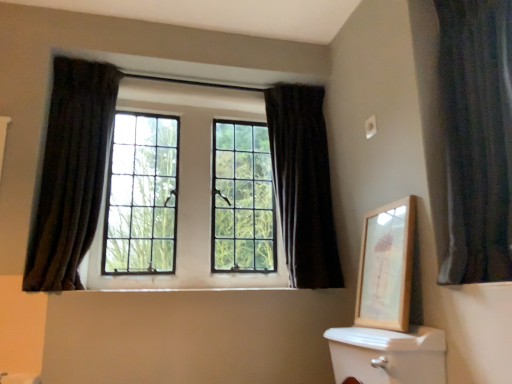
Describe the element at coordinates (476, 138) in the screenshot. I see `dark velvet curtain at right, acting as the third curtain starting from the left` at that location.

Describe the element at coordinates (303, 184) in the screenshot. I see `dark velvet curtain at upper center, the 2th curtain viewed from the left` at that location.

Find the location of a particular element. This screenshot has width=512, height=384. wooden picture frame at upper right is located at coordinates (386, 266).

From a real-world perspective, is dark velvet curtain at left, the third curtain positioned from the right, over matte glass windows at center?

→ No.

Could you tell me if dark velvet curtain at left, the third curtain positioned from the right, is turned towards matte glass windows at center?

No, dark velvet curtain at left, the third curtain positioned from the right, is not facing towards matte glass windows at center.

Considering the positions of objects dark velvet curtain at left, positioned as the 1th curtain in left-to-right order, and matte glass windows at center in the image provided, who is more to the right, dark velvet curtain at left, positioned as the 1th curtain in left-to-right order, or matte glass windows at center?

matte glass windows at center is more to the right.

Is point (40, 266) farther from viewer compared to point (141, 260)?

No, it is in front of (141, 260).

Considering the sizes of matte glass windows at center and dark velvet curtain at left, positioned as the 1th curtain in left-to-right order, in the image, is matte glass windows at center wider or thinner than dark velvet curtain at left, positioned as the 1th curtain in left-to-right order,?

Clearly, matte glass windows at center has less width compared to dark velvet curtain at left, positioned as the 1th curtain in left-to-right order.

Is point (211, 286) closer to camera compared to point (80, 95)?

That is False.

From the image's perspective, who appears lower, matte glass windows at center or dark velvet curtain at left, positioned as the 1th curtain in left-to-right order?

From the image's view, matte glass windows at center is below.

Locate an element on the screen. Image resolution: width=512 pixels, height=384 pixels. the 2nd curtain below the matte glass windows at center (from a real-world perspective) is located at coordinates (71, 173).

Is dark velvet curtain at left, the third curtain positioned from the right, in front of or behind wooden picture frame at upper right in the image?

Clearly, dark velvet curtain at left, the third curtain positioned from the right, is behind wooden picture frame at upper right.

Consider the image. Considering the relative positions of dark velvet curtain at left, the third curtain positioned from the right, and wooden picture frame at upper right in the image provided, is dark velvet curtain at left, the third curtain positioned from the right, to the right of wooden picture frame at upper right from the viewer's perspective?

In fact, dark velvet curtain at left, the third curtain positioned from the right, is to the left of wooden picture frame at upper right.

How different are the orientations of wooden picture frame at upper right and matte glass windows at center in degrees?

They differ by 88.9 degrees in their facing directions.

Considering the relative sizes of wooden picture frame at upper right and matte glass windows at center in the image provided, is wooden picture frame at upper right shorter than matte glass windows at center?

Indeed, wooden picture frame at upper right has a lesser height compared to matte glass windows at center.

Can you confirm if wooden picture frame at upper right is bigger than matte glass windows at center?

No.

Relative to matte glass windows at center, is wooden picture frame at upper right in front or behind?

Visually, wooden picture frame at upper right is located in front of matte glass windows at center.

Looking at the image, does dark velvet curtain at upper center, the 2th curtain viewed from the left, seem bigger or smaller compared to dark velvet curtain at right, acting as the third curtain starting from the left?

Clearly, dark velvet curtain at upper center, the 2th curtain viewed from the left, is larger in size than dark velvet curtain at right, acting as the third curtain starting from the left.

Which point is more forward, [314,162] or [465,102]?

The point [465,102] is in front.

Consider the image. Is dark velvet curtain at upper center, the 2th curtain viewed from the left, not near dark velvet curtain at right, which is counted as the 1th curtain, starting from the right?

No, there isn't a large distance between dark velvet curtain at upper center, the 2th curtain viewed from the left, and dark velvet curtain at right, which is counted as the 1th curtain, starting from the right.

Could you tell me if dark velvet curtain at upper center, the 2th curtain viewed from the left, is facing dark velvet curtain at right, acting as the third curtain starting from the left?

Yes, dark velvet curtain at upper center, the 2th curtain viewed from the left, is turned towards dark velvet curtain at right, acting as the third curtain starting from the left.

Would you say wooden picture frame at upper right is part of matte glass windows at center's contents?

Actually, wooden picture frame at upper right is outside matte glass windows at center.

Is matte glass windows at center in front of or behind wooden picture frame at upper right in the image?

Visually, matte glass windows at center is located behind wooden picture frame at upper right.

Considering the sizes of matte glass windows at center and wooden picture frame at upper right in the image, is matte glass windows at center bigger or smaller than wooden picture frame at upper right?

Considering their sizes, matte glass windows at center takes up more space than wooden picture frame at upper right.

From a real-world perspective, does matte glass windows at center stand above wooden picture frame at upper right?

Correct, in the physical world, matte glass windows at center is higher than wooden picture frame at upper right.

Considering the sizes of objects dark velvet curtain at upper center, the 2th curtain viewed from the left, and dark velvet curtain at left, positioned as the 1th curtain in left-to-right order, in the image provided, who is thinner, dark velvet curtain at upper center, the 2th curtain viewed from the left, or dark velvet curtain at left, positioned as the 1th curtain in left-to-right order,?

Thinner between the two is dark velvet curtain at left, positioned as the 1th curtain in left-to-right order.

From a real-world perspective, who is located higher, dark velvet curtain at upper center, the 2th curtain viewed from the left, or dark velvet curtain at left, positioned as the 1th curtain in left-to-right order?

dark velvet curtain at upper center, the 2th curtain viewed from the left, is physically above.

Is dark velvet curtain at upper center, the 2th curtain viewed from the left, oriented towards dark velvet curtain at left, the third curtain positioned from the right?

No, dark velvet curtain at upper center, the 2th curtain viewed from the left, is not aimed at dark velvet curtain at left, the third curtain positioned from the right.

Where is `bay window below the dark velvet curtain at left, positioned as the 1th curtain in left-to-right order (from the image's perspective)`? bay window below the dark velvet curtain at left, positioned as the 1th curtain in left-to-right order (from the image's perspective) is located at coordinates (190, 202).

This screenshot has height=384, width=512. Identify the location of the 2nd curtain located beneath the matte glass windows at center (from a real-world perspective). (71, 173).

From the image, which object appears to be nearer to dark velvet curtain at left, positioned as the 1th curtain in left-to-right order, matte glass windows at center or wooden picture frame at upper right?

matte glass windows at center is positioned closer to the anchor dark velvet curtain at left, positioned as the 1th curtain in left-to-right order.

Estimate the real-world distances between objects in this image. Which object is closer to wooden picture frame at upper right, matte glass windows at center or dark velvet curtain at upper center, the 2th curtain viewed from the left?

dark velvet curtain at upper center, the 2th curtain viewed from the left, is positioned closer to the anchor wooden picture frame at upper right.

From the picture: From the image, which object appears to be farther from dark velvet curtain at left, the third curtain positioned from the right, wooden picture frame at upper right or dark velvet curtain at upper center, marked as the second curtain in a right-to-left arrangement?

The object further to dark velvet curtain at left, the third curtain positioned from the right, is wooden picture frame at upper right.

Estimate the real-world distances between objects in this image. Which object is further from dark velvet curtain at upper center, marked as the second curtain in a right-to-left arrangement, dark velvet curtain at right, which is counted as the 1th curtain, starting from the right, or dark velvet curtain at left, the third curtain positioned from the right?

Based on the image, dark velvet curtain at left, the third curtain positioned from the right, appears to be further to dark velvet curtain at upper center, marked as the second curtain in a right-to-left arrangement.

Which object lies nearer to the anchor point dark velvet curtain at upper center, marked as the second curtain in a right-to-left arrangement, matte glass windows at center or dark velvet curtain at right, acting as the third curtain starting from the left?

The object closer to dark velvet curtain at upper center, marked as the second curtain in a right-to-left arrangement, is matte glass windows at center.

Considering their positions, is wooden picture frame at upper right positioned further to dark velvet curtain at right, which is counted as the 1th curtain, starting from the right, than dark velvet curtain at upper center, marked as the second curtain in a right-to-left arrangement?

dark velvet curtain at upper center, marked as the second curtain in a right-to-left arrangement.

Which object lies nearer to the anchor point dark velvet curtain at right, which is counted as the 1th curtain, starting from the right, dark velvet curtain at left, positioned as the 1th curtain in left-to-right order, or wooden picture frame at upper right?

Based on the image, wooden picture frame at upper right appears to be nearer to dark velvet curtain at right, which is counted as the 1th curtain, starting from the right.

Looking at the image, which one is located closer to matte glass windows at center, dark velvet curtain at right, which is counted as the 1th curtain, starting from the right, or dark velvet curtain at left, the third curtain positioned from the right?

Based on the image, dark velvet curtain at left, the third curtain positioned from the right, appears to be nearer to matte glass windows at center.

Where is `picture frame between matte glass windows at center and dark velvet curtain at right, acting as the third curtain starting from the left, from left to right`? picture frame between matte glass windows at center and dark velvet curtain at right, acting as the third curtain starting from the left, from left to right is located at coordinates (386, 266).

At what (x,y) coordinates should I click in order to perform the action: click on curtain located between matte glass windows at center and wooden picture frame at upper right in the left-right direction. Please return your answer as a coordinate pair (x, y). The height and width of the screenshot is (384, 512). Looking at the image, I should click on (303, 184).

In order to click on bay window between dark velvet curtain at left, positioned as the 1th curtain in left-to-right order, and wooden picture frame at upper right, in the horizontal direction in this screenshot , I will do `click(190, 202)`.

I want to click on picture frame located between dark velvet curtain at right, which is counted as the 1th curtain, starting from the right, and dark velvet curtain at upper center, marked as the second curtain in a right-to-left arrangement, in the depth direction, so click(386, 266).